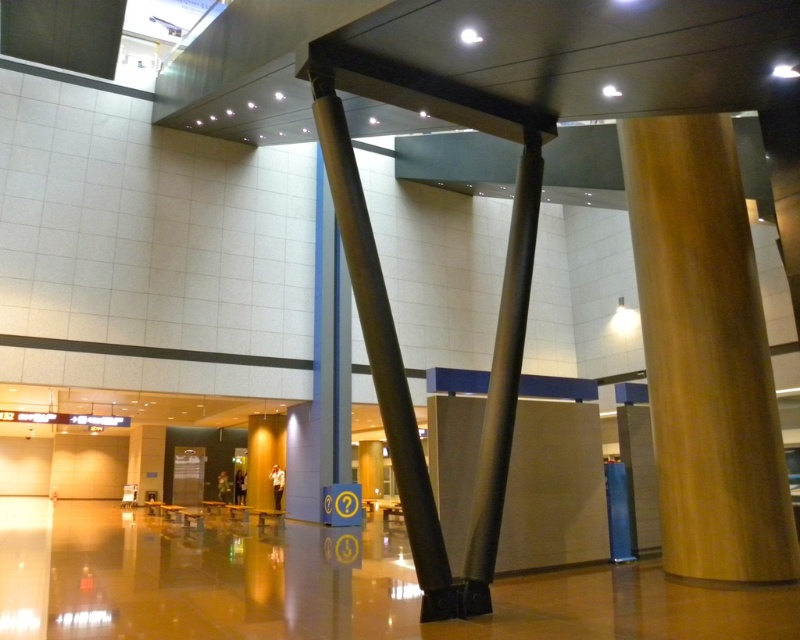
Question: Which of the following is the closest to the observer?

Choices:
 (A) satin gold pole at center
 (B) metallic gray pole at center

Answer: (B)

Question: Which object is farther from the camera taking this photo?

Choices:
 (A) gold polished column at center
 (B) satin gold pole at center
 (C) metallic gray pole at center

Answer: (A)

Question: Does gold polished column at center lie behind satin gold pole at center?

Choices:
 (A) yes
 (B) no

Answer: (A)

Question: Does metallic gray pole at center appear over satin gold pole at center?

Choices:
 (A) yes
 (B) no

Answer: (B)

Question: Which object is the closest to the metallic gray pole at center?

Choices:
 (A) gold polished column at center
 (B) satin gold pole at center

Answer: (B)

Question: Does metallic gray pole at center appear over satin gold pole at center?

Choices:
 (A) yes
 (B) no

Answer: (B)